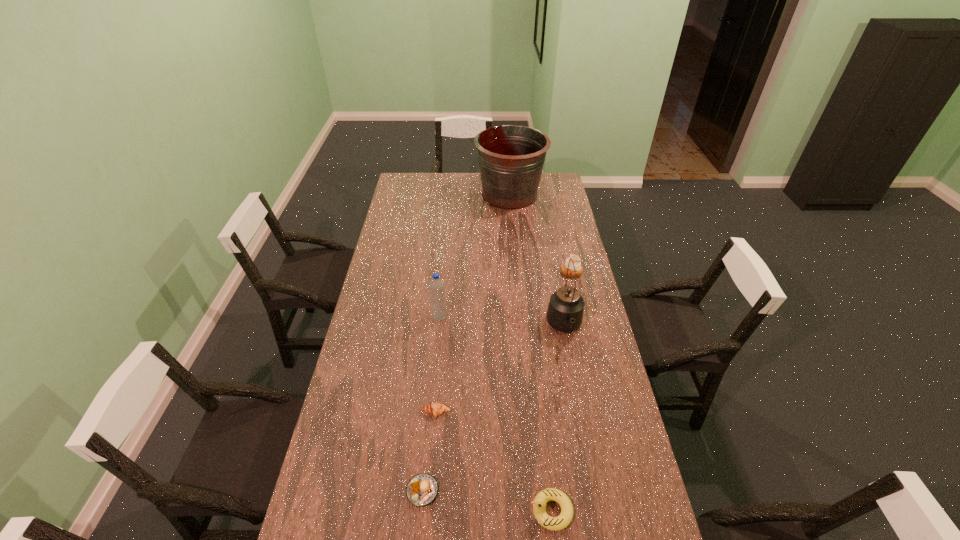
Find the location of a particular element. pastry situated at the right edge is located at coordinates (576, 259).

Locate an element on the screen. object positioned at the far right corner is located at coordinates (511, 157).

Locate an element on the screen. The width and height of the screenshot is (960, 540). vacant space at the far edge is located at coordinates (477, 187).

In the image, there is a desktop. Where is `vacant space at the left edge`? The height and width of the screenshot is (540, 960). vacant space at the left edge is located at coordinates (390, 242).

In the image, there is a desktop. Where is `vacant space at the right edge`? This screenshot has height=540, width=960. vacant space at the right edge is located at coordinates (x=623, y=409).

Locate an element on the screen. The width and height of the screenshot is (960, 540). vacant region at the far left corner of the desktop is located at coordinates (404, 177).

You are a GUI agent. You are given a task and a screenshot of the screen. Output one action in this format:
    pyautogui.click(x=<x>, y=<y>)
    Task: Click on the free space between the tallest pastry and the nearest pastry
    The width and height of the screenshot is (960, 540).
    Given the screenshot: What is the action you would take?
    pyautogui.click(x=497, y=381)

Locate an element on the screen. The image size is (960, 540). empty space that is in between the kettle and the water bottle is located at coordinates (502, 322).

Identify the location of free point between the nearest pastry and the kettle. The height and width of the screenshot is (540, 960). (493, 409).

Image resolution: width=960 pixels, height=540 pixels. I want to click on free point between the kettle and the farthest object, so click(537, 261).